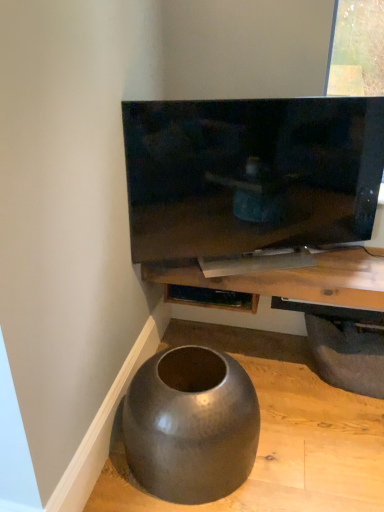
Question: Should I look upward or downward to see matte gray concrete at lower left?

Choices:
 (A) up
 (B) down

Answer: (B)

Question: Is matte gray concrete at lower left positioned beyond the bounds of matte black shelf at lower center?

Choices:
 (A) yes
 (B) no

Answer: (A)

Question: Considering the relative positions of matte gray concrete at lower left and matte black shelf at lower center in the image provided, is matte gray concrete at lower left to the left of matte black shelf at lower center from the viewer's perspective?

Choices:
 (A) no
 (B) yes

Answer: (A)

Question: Does matte gray concrete at lower left touch matte black shelf at lower center?

Choices:
 (A) no
 (B) yes

Answer: (A)

Question: From the image's perspective, is matte gray concrete at lower left over matte black shelf at lower center?

Choices:
 (A) no
 (B) yes

Answer: (A)

Question: Considering the relative sizes of matte gray concrete at lower left and matte black shelf at lower center in the image provided, is matte gray concrete at lower left wider than matte black shelf at lower center?

Choices:
 (A) yes
 (B) no

Answer: (A)

Question: Is matte gray concrete at lower left closer to camera compared to matte black shelf at lower center?

Choices:
 (A) no
 (B) yes

Answer: (B)

Question: From the image's perspective, is matte black tv at upper center above dark gray rubber tire at lower right?

Choices:
 (A) yes
 (B) no

Answer: (A)

Question: From a real-world perspective, is matte black tv at upper center below dark gray rubber tire at lower right?

Choices:
 (A) no
 (B) yes

Answer: (A)

Question: Considering the relative sizes of matte black tv at upper center and dark gray rubber tire at lower right in the image provided, is matte black tv at upper center taller than dark gray rubber tire at lower right?

Choices:
 (A) no
 (B) yes

Answer: (B)

Question: Is matte black tv at upper center not inside dark gray rubber tire at lower right?

Choices:
 (A) no
 (B) yes

Answer: (B)

Question: Is matte black tv at upper center at the left side of dark gray rubber tire at lower right?

Choices:
 (A) no
 (B) yes

Answer: (B)

Question: Is the position of matte black tv at upper center more distant than that of dark gray rubber tire at lower right?

Choices:
 (A) no
 (B) yes

Answer: (A)

Question: Is dark gray rubber tire at lower right closer to the viewer compared to wooden shelf at center?

Choices:
 (A) yes
 (B) no

Answer: (B)